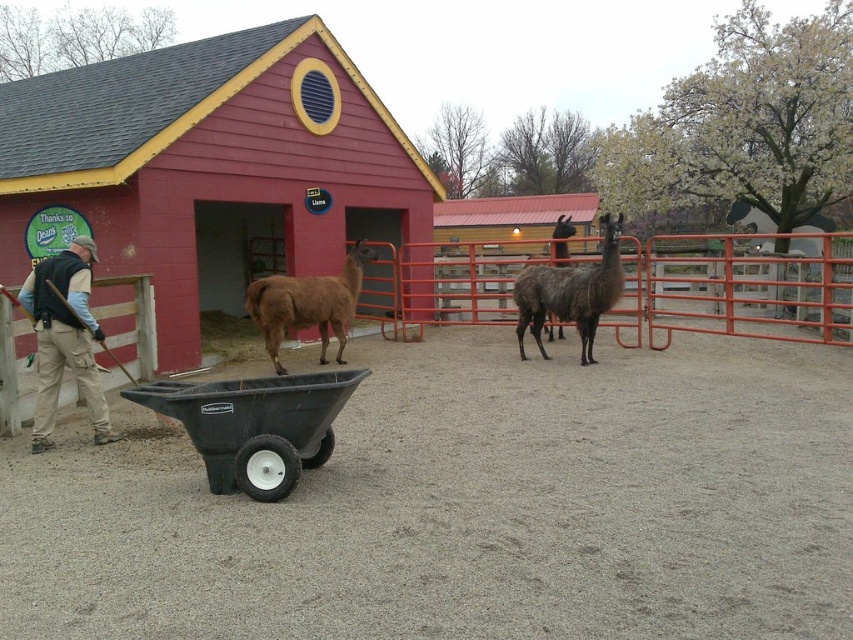
How much distance is there between dark brown woolly alpaca at center and brown woolly alpaca at center?

dark brown woolly alpaca at center is 3.70 meters away from brown woolly alpaca at center.

Is dark brown woolly alpaca at center wider than brown woolly alpaca at center?

No.

Locate an element on the screen. The image size is (853, 640). dark brown woolly alpaca at center is located at coordinates (572, 292).

Does black rubber wheelbarrow at center appear on the right side of dark brown woolly alpaca at center?

Incorrect, black rubber wheelbarrow at center is not on the right side of dark brown woolly alpaca at center.

Is point (282, 445) less distant than point (581, 332)?

Yes, point (282, 445) is closer to viewer.

Find the location of a particular element. The height and width of the screenshot is (640, 853). black rubber wheelbarrow at center is located at coordinates (254, 426).

Can you confirm if khaki pants at left is shorter than dark brown woolly alpaca at center?

No, khaki pants at left is not shorter than dark brown woolly alpaca at center.

Does khaki pants at left appear on the left side of dark brown woolly alpaca at center?

Indeed, khaki pants at left is positioned on the left side of dark brown woolly alpaca at center.

Image resolution: width=853 pixels, height=640 pixels. Identify the location of khaki pants at left. (64, 337).